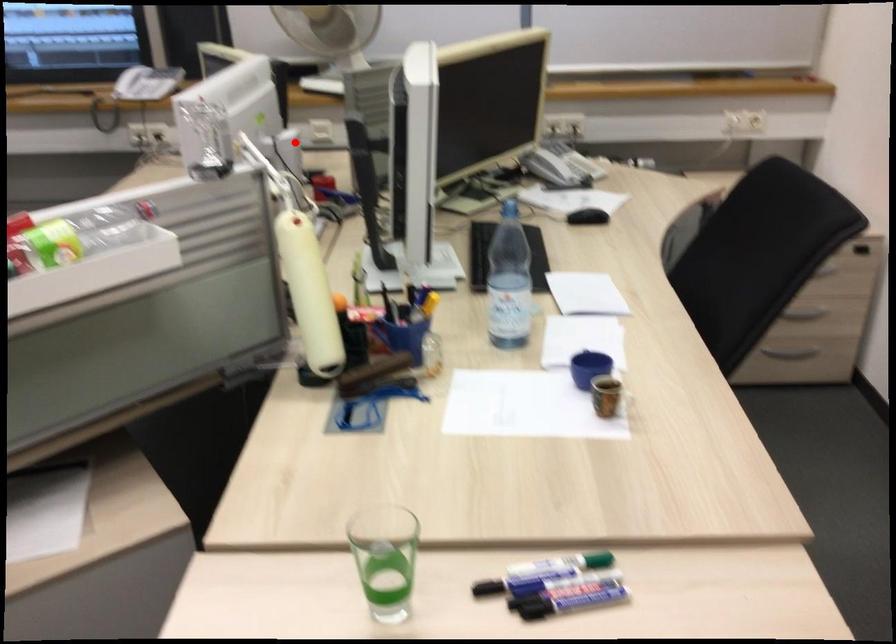
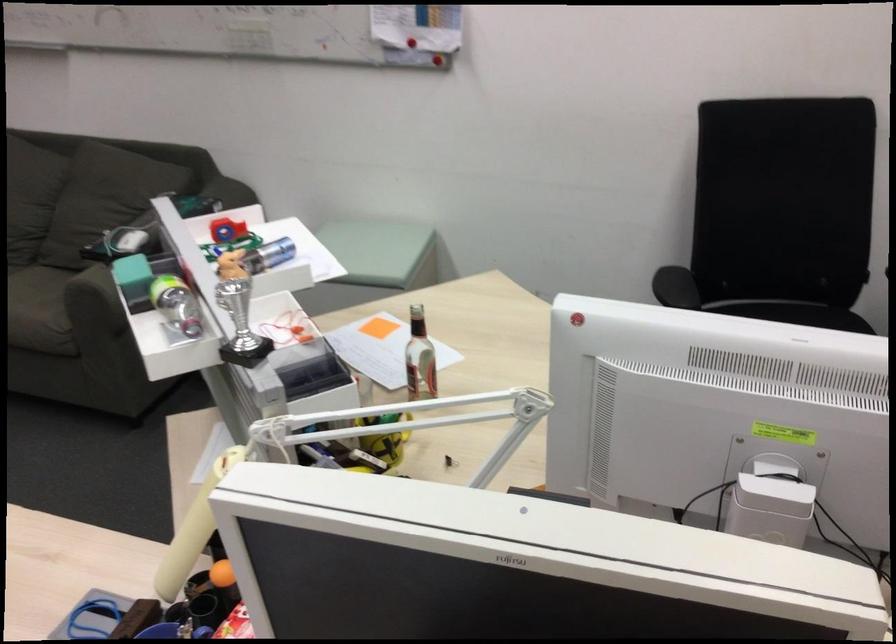
The point at the highlighted location is marked in the first image. Where is the corresponding point in the second image?

(770, 509)